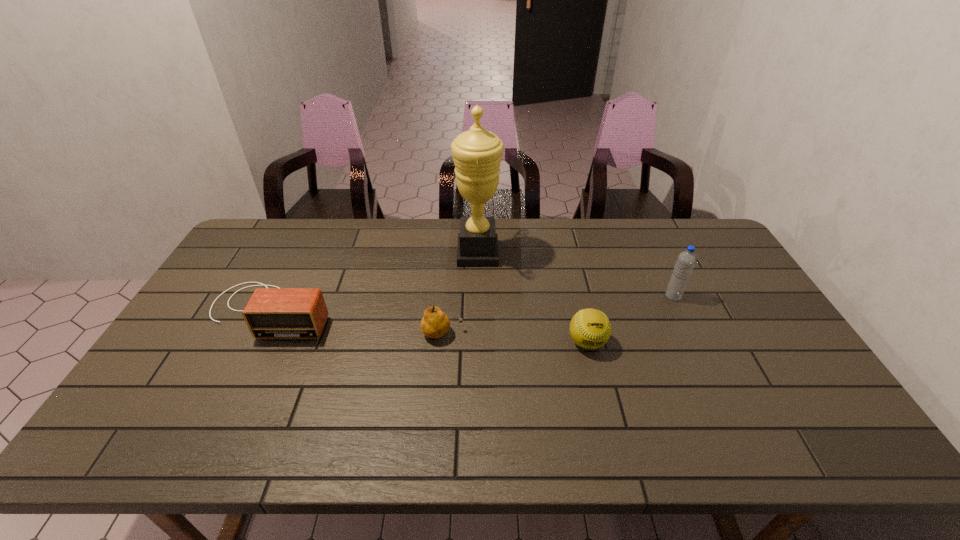
I want to click on vacant space at the far right corner of the desktop, so click(685, 221).

The height and width of the screenshot is (540, 960). I want to click on vacant area that lies between the rightmost object and the pear, so click(558, 315).

Locate an element on the screen. vacant space that is in between the water bottle and the tallest object is located at coordinates (575, 275).

At what (x,y) coordinates should I click in order to perform the action: click on vacant space that's between the fourth shortest object and the pear. Please return your answer as a coordinate pair (x, y). Image resolution: width=960 pixels, height=540 pixels. Looking at the image, I should click on (558, 315).

Find the location of `free area in between the second object from right to left and the second tallest object`. free area in between the second object from right to left and the second tallest object is located at coordinates (630, 319).

Identify the location of vacant space in between the trophy cup and the leftmost object. Image resolution: width=960 pixels, height=540 pixels. (374, 282).

You are a GUI agent. You are given a task and a screenshot of the screen. Output one action in this format:
    pyautogui.click(x=<x>, y=<y>)
    Task: Click on the free space between the softball and the pear
    The width and height of the screenshot is (960, 540).
    Given the screenshot: What is the action you would take?
    pyautogui.click(x=515, y=338)

Where is `free point between the rightmost object and the pear`? Image resolution: width=960 pixels, height=540 pixels. free point between the rightmost object and the pear is located at coordinates click(x=558, y=315).

Find the location of `free space that is in between the pear and the water bottle`. free space that is in between the pear and the water bottle is located at coordinates (558, 315).

In order to click on blank region between the fourth object from left to right and the tallest object in this screenshot , I will do `click(533, 298)`.